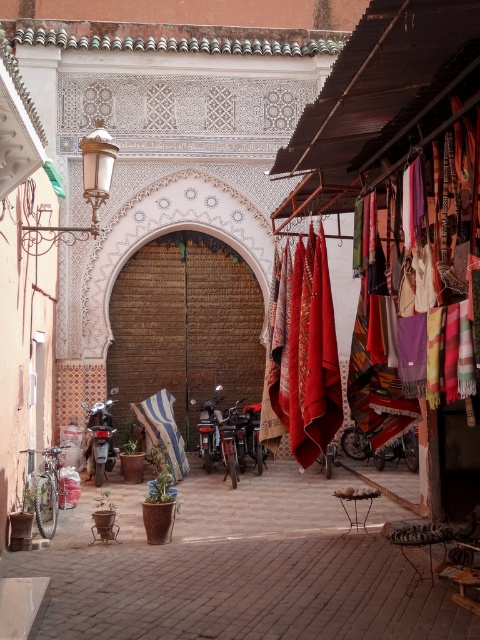
You are a tourist walking down the street and want to take a photo of both the blue striped fabric at center and the shiny metallic motorcycle at center. Which object should you focus on first to ensure both are in the frame?

You should focus on the blue striped fabric at center first because it is closer to you than the shiny metallic motorcycle at center, so adjusting the camera to include both would require starting with the closer object.

Consider the image. You are a street performer who needs to set up a small stage between the textured woolen scarves at center and the shiny metallic motorcycle at center. Which object should you place the stage closer to if you want the stage to be wider than both objects?

The stage should be placed closer to the shiny metallic motorcycle at center because it has a greater width than the textured woolen scarves at center, allowing the stage to be wider than both.